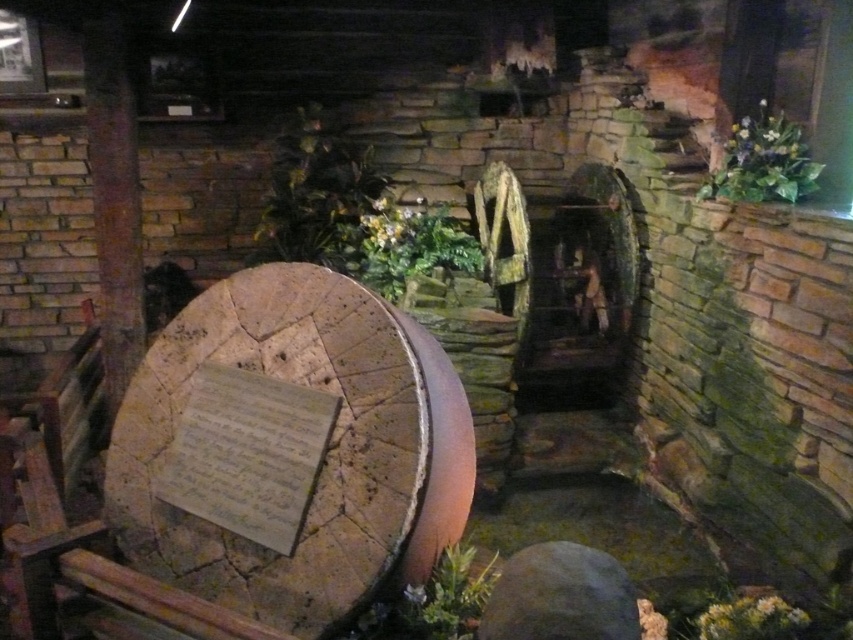
Question: Which point appears closest to the camera in this image?

Choices:
 (A) (395, 220)
 (B) (434, 572)
 (C) (289, 145)
 (D) (753, 148)

Answer: (B)

Question: Based on their relative distances, which object is farther from the green leafy plant at lower center?

Choices:
 (A) green leafy plant at center
 (B) green leafy plant at upper right

Answer: (B)

Question: Does green leafy plant at lower center have a lesser width compared to green leafy plant at lower right?

Choices:
 (A) no
 (B) yes

Answer: (A)

Question: Does green leafy plant at upper center appear under green leafy plant at lower center?

Choices:
 (A) no
 (B) yes

Answer: (A)

Question: Which point appears closest to the camera in this image?

Choices:
 (A) (331, 241)
 (B) (747, 628)
 (C) (451, 250)

Answer: (B)

Question: Can you confirm if green leafy plant at lower center is positioned above green leafy plant at lower right?

Choices:
 (A) yes
 (B) no

Answer: (A)